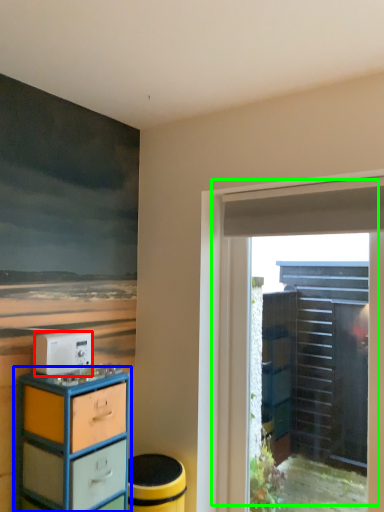
Question: Estimate the real-world distances between objects in this image. Which object is closer to appliance (highlighted by a red box), chest of drawers (highlighted by a blue box) or door (highlighted by a green box)?

Choices:
 (A) chest of drawers
 (B) door

Answer: (A)